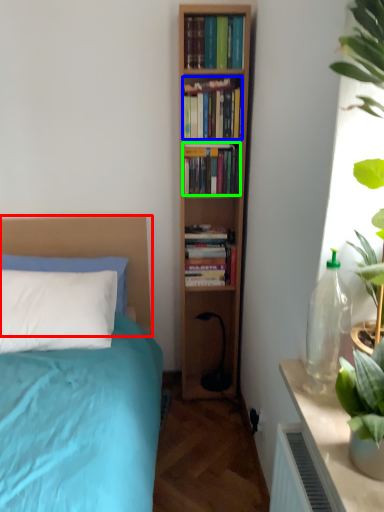
Question: Which object is positioned closest to headboard (highlighted by a red box)? Select from book (highlighted by a blue box) and book (highlighted by a green box).

Choices:
 (A) book
 (B) book

Answer: (B)